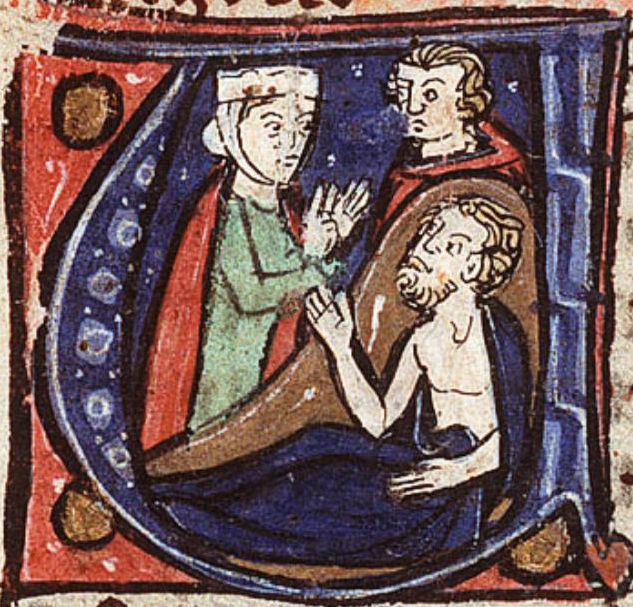
Locate an element on the screen. This screenshot has height=607, width=633. painting is located at coordinates (353, 217).